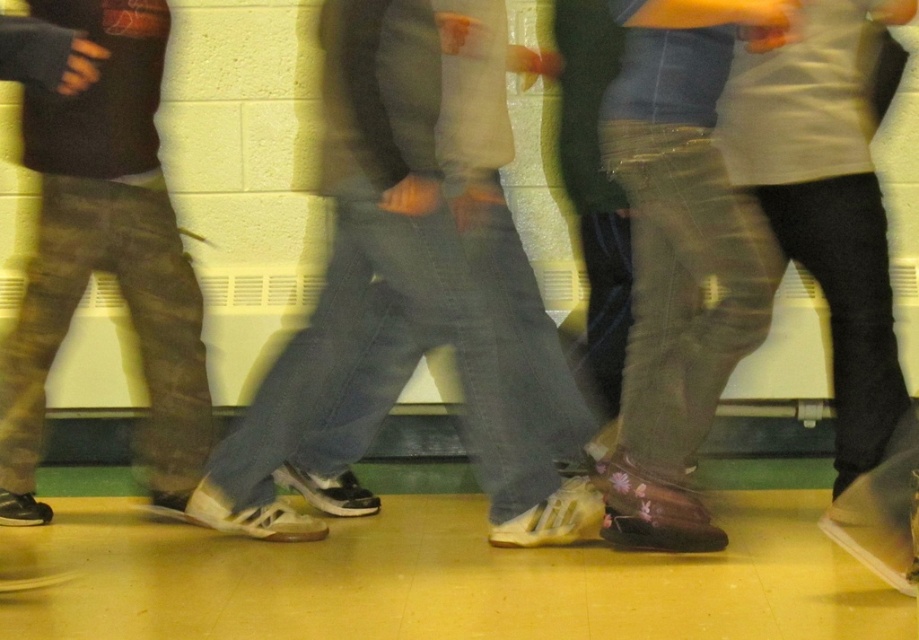
Is floral leather boots at center below camouflage pants at left?

Yes.

Which is behind, point (696, 131) or point (64, 182)?

Point (64, 182)

Where is `floral leather boots at center`? The height and width of the screenshot is (640, 919). floral leather boots at center is located at coordinates (679, 257).

Between white matte sneakers at center and camouflage pants at left, which one is positioned higher?

camouflage pants at left is above.

Does white matte sneakers at center appear under camouflage pants at left?

Yes.

Which is in front, point (275, 420) or point (133, 13)?

Point (133, 13) is in front.

The image size is (919, 640). In order to click on white matte sneakers at center in this screenshot , I will do `click(414, 289)`.

Which is more to the left, white matte sneakers at center or floral leather boots at center?

white matte sneakers at center is more to the left.

Can you confirm if white matte sneakers at center is bigger than floral leather boots at center?

Indeed, white matte sneakers at center has a larger size compared to floral leather boots at center.

The width and height of the screenshot is (919, 640). In order to click on white matte sneakers at center in this screenshot , I will do `click(414, 289)`.